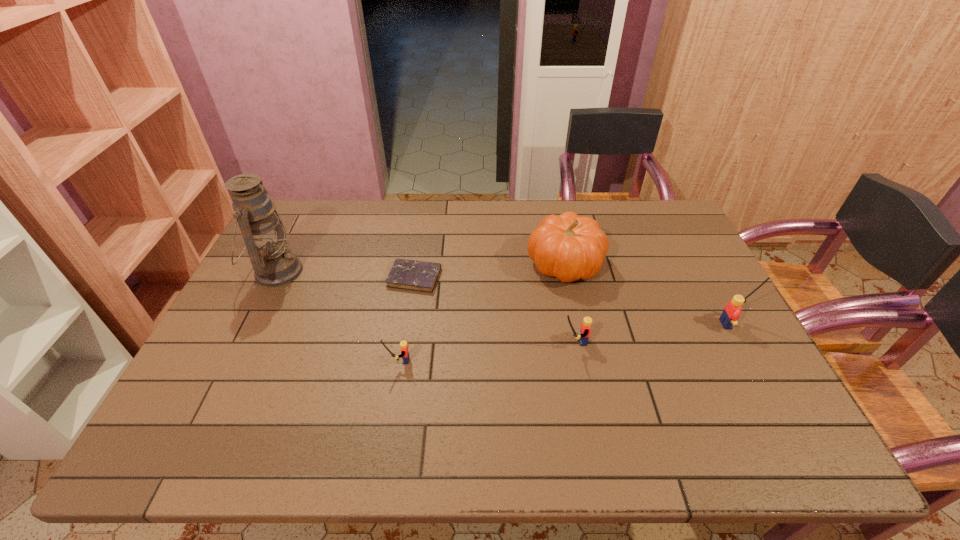
Where is `free spot between the pumpkin and the shortest object`? The image size is (960, 540). free spot between the pumpkin and the shortest object is located at coordinates (490, 271).

This screenshot has height=540, width=960. I want to click on vacant space that is in between the shortest object and the shortest Lego, so click(x=406, y=319).

You are a GUI agent. You are given a task and a screenshot of the screen. Output one action in this format:
    pyautogui.click(x=<x>, y=<y>)
    Task: Click on the empty location between the tallest Lego and the shortest Lego
    
    Given the screenshot: What is the action you would take?
    pyautogui.click(x=567, y=342)

Where is `vacant space that's between the second Lego from left to right and the oil lamp`? The height and width of the screenshot is (540, 960). vacant space that's between the second Lego from left to right and the oil lamp is located at coordinates (425, 307).

At what (x,y) coordinates should I click in order to perform the action: click on free space between the second shortest object and the pumpkin. Please return your answer as a coordinate pair (x, y). Looking at the image, I should click on (482, 312).

This screenshot has height=540, width=960. Find the location of `vacant space that's between the second Lego from right to left and the pumpkin`. vacant space that's between the second Lego from right to left and the pumpkin is located at coordinates (569, 303).

Find the location of a particular element. unoccupied area between the diary and the rightmost object is located at coordinates (575, 301).

Find the location of `free space between the shortest object and the pumpkin`. free space between the shortest object and the pumpkin is located at coordinates (490, 271).

Locate which object is the third closest to the tallest object. Please provide its 2D coordinates. Your answer should be formatted as a tuple, i.e. [(x, y)], where the tuple contains the x and y coordinates of a point satisfying the conditions above.

[(568, 247)]

You are a GUI agent. You are given a task and a screenshot of the screen. Output one action in this format:
    pyautogui.click(x=<x>, y=<y>)
    Task: Click on the object that stands as the closest to the leftmost object
    The height and width of the screenshot is (540, 960).
    Given the screenshot: What is the action you would take?
    pyautogui.click(x=414, y=275)